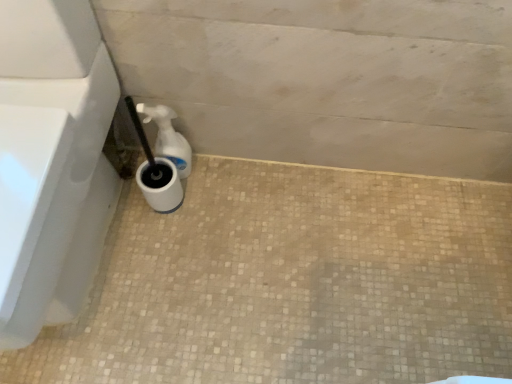
Question: Is white plastic spray bottle at lower left facing towards white matte concrete at lower center?

Choices:
 (A) no
 (B) yes

Answer: (A)

Question: From the image's perspective, is white plastic spray bottle at lower left on top of white matte concrete at lower center?

Choices:
 (A) no
 (B) yes

Answer: (B)

Question: Is white plastic spray bottle at lower left shorter than white matte concrete at lower center?

Choices:
 (A) no
 (B) yes

Answer: (A)

Question: Does white plastic spray bottle at lower left have a greater width compared to white matte concrete at lower center?

Choices:
 (A) no
 (B) yes

Answer: (A)

Question: Is white plastic spray bottle at lower left located outside white matte concrete at lower center?

Choices:
 (A) yes
 (B) no

Answer: (A)

Question: Does white plastic spray bottle at lower left have a greater height compared to white matte concrete at lower center?

Choices:
 (A) yes
 (B) no

Answer: (A)

Question: Does white matte concrete at lower center appear on the right side of white plastic spray bottle at lower left?

Choices:
 (A) yes
 (B) no

Answer: (A)

Question: From the image's perspective, is white matte concrete at lower center on top of white plastic spray bottle at lower left?

Choices:
 (A) no
 (B) yes

Answer: (A)

Question: Can you confirm if white matte concrete at lower center is bigger than white plastic spray bottle at lower left?

Choices:
 (A) no
 (B) yes

Answer: (B)

Question: Is white plastic spray bottle at lower left inside white matte concrete at lower center?

Choices:
 (A) no
 (B) yes

Answer: (A)

Question: Is white matte concrete at lower center aimed at white plastic spray bottle at lower left?

Choices:
 (A) no
 (B) yes

Answer: (A)

Question: Is white matte concrete at lower center not near white plastic spray bottle at lower left?

Choices:
 (A) yes
 (B) no

Answer: (B)

Question: Would you consider white glossy toilet at lower left to be distant from white matte concrete at lower center?

Choices:
 (A) yes
 (B) no

Answer: (B)